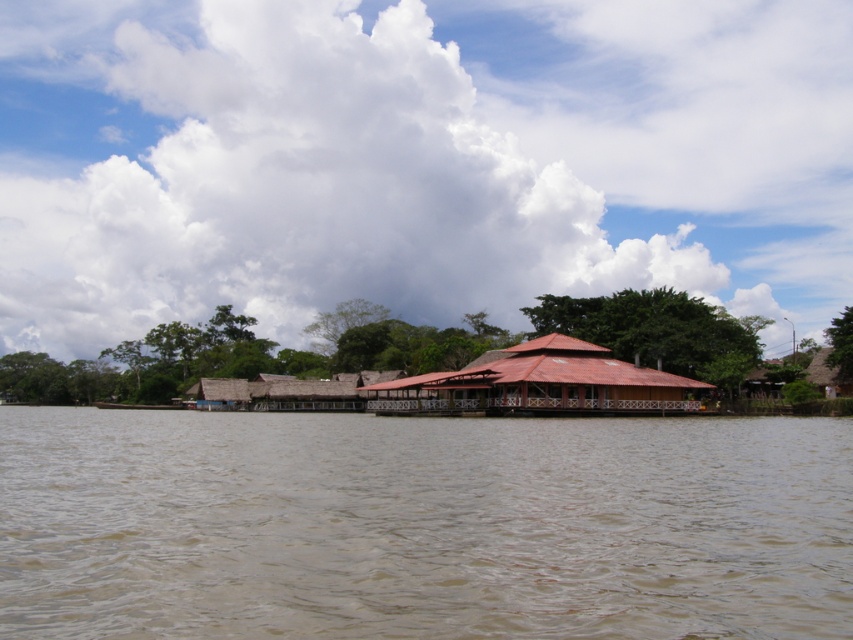
You are standing at the riverside and want to reach the point at coordinates point (x=392, y=465). If your walking speed is 3 feet per second, how many seconds will it take you to reach that point?

The distance between you and point (x=392, y=465) is 89.94 feet. At a speed of 3 feet per second, it will take approximately 30 seconds to reach the point.

Consider the image. You are standing on the riverside path and see the brown muddy water at center and the red thatched hut at center. Which object is closer to the ground?

The brown muddy water at center is closer to the ground because it is positioned below the red thatched hut at center.

You are standing at the riverside and see two points marked in the scene. The first point is at coordinates point (x=689, y=552) and the second is at point (x=616, y=371). Which point is closer to you?

Point (x=689, y=552) is in front of point (x=616, y=371), so it is closer to you.